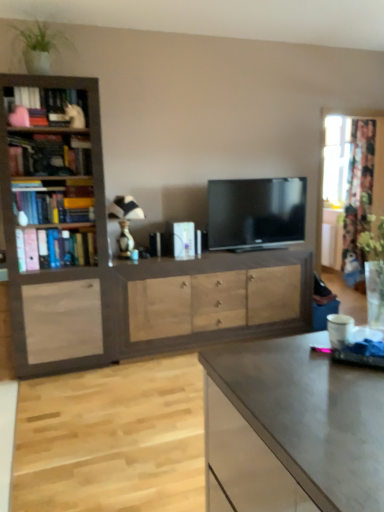
In order to face wooden bookcase at left, should I rotate leftwards or rightwards?

A 17.441 degree turn to the left will do.

What do you see at coordinates (125, 221) in the screenshot? I see `white striped fabric lampshade at center` at bounding box center [125, 221].

What is the approximate height of light wood drawer at center?

32.15 inches.

What do you see at coordinates (212, 301) in the screenshot? I see `light wood drawer at center` at bounding box center [212, 301].

Image resolution: width=384 pixels, height=512 pixels. What do you see at coordinates (358, 193) in the screenshot?
I see `floral fabric curtain at right` at bounding box center [358, 193].

Where is `hardcover books at left`? This screenshot has width=384, height=512. hardcover books at left is located at coordinates (55, 248).

Find the location of `television located above the light wood drawer at center (from the image's perspective)`. television located above the light wood drawer at center (from the image's perspective) is located at coordinates (256, 213).

Can you tell me how much black glossy tv at center and light wood drawer at center differ in facing direction?

The facing directions of black glossy tv at center and light wood drawer at center are 0.62 degrees apart.

Does black glossy tv at center turn towards light wood drawer at center?

No.

Does point (230, 240) come closer to viewer compared to point (128, 302)?

No, (230, 240) is further to viewer.

Consider the image. From the image's perspective, is light wood drawer at center positioned above or below black glossy tv at center?

light wood drawer at center is below black glossy tv at center.

Is point (208, 283) closer or farther from the camera than point (258, 189)?

Point (208, 283) is closer to the camera than point (258, 189).

Is light wood drawer at center positioned with its back to black glossy tv at center?

No.

The image size is (384, 512). What are the coordinates of `television behind the light wood drawer at center` in the screenshot? It's located at (256, 213).

Can you tell me how much hardcover books at left and white striped fabric lampshade at center differ in facing direction?

The angle between the facing direction of hardcover books at left and the facing direction of white striped fabric lampshade at center is 0.618 degrees.

Is the depth of hardcover books at left greater than that of white striped fabric lampshade at center?

That is False.

Which object is positioned more to the left, hardcover books at left or white striped fabric lampshade at center?

From the viewer's perspective, hardcover books at left appears more on the left side.

In terms of width, does hardcover books at left look wider or thinner when compared to white striped fabric lampshade at center?

hardcover books at left is thinner than white striped fabric lampshade at center.

From a real-world perspective, is hardcover books at left under light wood drawer at center?

No, from a real-world perspective, hardcover books at left is not under light wood drawer at center.

In the image, is hardcover books at left positioned in front of or behind light wood drawer at center?

hardcover books at left is in front of light wood drawer at center.

Can we say hardcover books at left lies outside light wood drawer at center?

That's correct, hardcover books at left is outside of light wood drawer at center.

Is hardcover books at left oriented away from light wood drawer at center?

hardcover books at left is not turned away from light wood drawer at center.

Which of these two, hardcover books at left or wooden bookcase at left, stands shorter?

With less height is hardcover books at left.

Would you say hardcover books at left is a long distance from wooden bookcase at left?

No, there isn't a large distance between hardcover books at left and wooden bookcase at left.

Looking at this image, between hardcover books at left and wooden bookcase at left, which one has smaller width?

Thinner between the two is hardcover books at left.

From the image's perspective, which is above, floral fabric curtain at right or green leafy plant at upper left?

From the image's view, green leafy plant at upper left is above.

From a real-world perspective, is floral fabric curtain at right located higher than green leafy plant at upper left?

Actually, floral fabric curtain at right is physically below green leafy plant at upper left in the real world.

Is floral fabric curtain at right oriented towards green leafy plant at upper left?

No, floral fabric curtain at right is not turned towards green leafy plant at upper left.

Does floral fabric curtain at right have a lesser height compared to green leafy plant at upper left?

No, floral fabric curtain at right is not shorter than green leafy plant at upper left.

Is point (35, 246) farther from viewer compared to point (270, 205)?

That is False.

Is hardcover books at left looking in the opposite direction of black glossy tv at center?

No.

Can you confirm if hardcover books at left is thinner than black glossy tv at center?

In fact, hardcover books at left might be wider than black glossy tv at center.

From the image's perspective, relative to black glossy tv at center, is hardcover books at left above or below?

Clearly, from the image's perspective, hardcover books at left is below black glossy tv at center.

The image size is (384, 512). Find the location of `drawer located underneath the black glossy tv at center (from a real-world perspective)`. drawer located underneath the black glossy tv at center (from a real-world perspective) is located at coordinates click(x=212, y=301).

Identify the location of television above the light wood drawer at center (from a real-world perspective). click(256, 213).

Looking at the image, which one is located closer to light wood drawer at center, matte gray desk at lower right or wooden bookcase at left?

wooden bookcase at left.

Which object lies further to the anchor point light wood drawer at center, black glossy tv at center or green leafy plant at upper left?

green leafy plant at upper left is positioned further to the anchor light wood drawer at center.

When comparing their distances from black glossy tv at center, does green leafy plant at upper left or floral fabric curtain at right seem further?

green leafy plant at upper left is further to black glossy tv at center.

When comparing their distances from floral fabric curtain at right, does black glossy tv at center or wooden bookcase at left seem further?

Among the two, wooden bookcase at left is located further to floral fabric curtain at right.

Which object lies nearer to the anchor point hardcover books at left, floral fabric curtain at right or matte gray desk at lower right?

matte gray desk at lower right is closer to hardcover books at left.

From the image, which object appears to be farther from light wood drawer at center, black glossy tv at center or white striped fabric lampshade at center?

white striped fabric lampshade at center lies further to light wood drawer at center than the other object.

Looking at the image, which one is located further to green leafy plant at upper left, black glossy tv at center or wooden bookcase at left?

→ black glossy tv at center.

When comparing their distances from matte gray desk at lower right, does white striped fabric lampshade at center or hardcover books at left seem further?

white striped fabric lampshade at center.

Identify the location of lamp that lies between green leafy plant at upper left and wooden bookcase at left from top to bottom. (125, 221).

Identify the location of book between green leafy plant at upper left and light wood drawer at center in the vertical direction. This screenshot has width=384, height=512. click(55, 248).

Where is `houseplant positioned between matte gray desk at lower right and black glossy tv at center from near to far`? houseplant positioned between matte gray desk at lower right and black glossy tv at center from near to far is located at coordinates (40, 46).

This screenshot has height=512, width=384. Identify the location of drawer between wooden bookcase at left and black glossy tv at center. (212, 301).